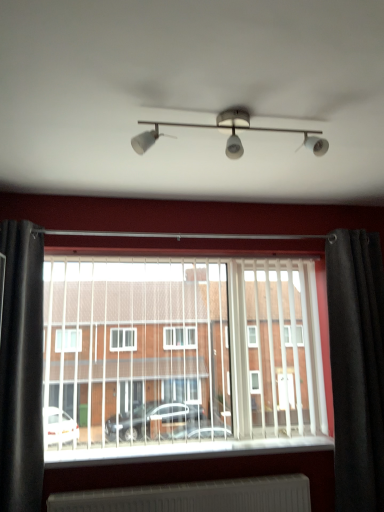
Question: Can you confirm if black velvet curtain at right, which ranks as the second curtain in left-to-right order, is thinner than black fabric curtain at left, the first curtain viewed from the left?

Choices:
 (A) yes
 (B) no

Answer: (B)

Question: Is black velvet curtain at right, marked as the first curtain in a right-to-left arrangement, facing away from black fabric curtain at left, the first curtain viewed from the left?

Choices:
 (A) yes
 (B) no

Answer: (B)

Question: Is black velvet curtain at right, marked as the first curtain in a right-to-left arrangement, positioned before black fabric curtain at left, the second curtain positioned from the right?

Choices:
 (A) no
 (B) yes

Answer: (A)

Question: From the image's perspective, does black velvet curtain at right, marked as the first curtain in a right-to-left arrangement, appear higher than black fabric curtain at left, the first curtain viewed from the left?

Choices:
 (A) no
 (B) yes

Answer: (A)

Question: Is black velvet curtain at right, which ranks as the second curtain in left-to-right order, next to black fabric curtain at left, the second curtain positioned from the right?

Choices:
 (A) no
 (B) yes

Answer: (A)

Question: Based on their positions, is white plastic blinds at center located to the left or right of black fabric curtain at left, the second curtain positioned from the right?

Choices:
 (A) right
 (B) left

Answer: (A)

Question: From the image's perspective, relative to black fabric curtain at left, the second curtain positioned from the right, is white plastic blinds at center above or below?

Choices:
 (A) below
 (B) above

Answer: (A)

Question: Is white plastic blinds at center wider or thinner than black fabric curtain at left, the first curtain viewed from the left?

Choices:
 (A) thin
 (B) wide

Answer: (A)

Question: Relative to black fabric curtain at left, the second curtain positioned from the right, is white plastic blinds at center in front or behind?

Choices:
 (A) front
 (B) behind

Answer: (B)

Question: Is white plastic blinds at center to the left or to the right of black velvet curtain at right, marked as the first curtain in a right-to-left arrangement, in the image?

Choices:
 (A) left
 (B) right

Answer: (A)

Question: Is white plastic blinds at center in front of or behind black velvet curtain at right, which ranks as the second curtain in left-to-right order, in the image?

Choices:
 (A) front
 (B) behind

Answer: (A)

Question: In terms of width, does white plastic blinds at center look wider or thinner when compared to black velvet curtain at right, which ranks as the second curtain in left-to-right order?

Choices:
 (A) thin
 (B) wide

Answer: (A)

Question: Considering the positions of white plastic blinds at center and black velvet curtain at right, which ranks as the second curtain in left-to-right order, in the image, is white plastic blinds at center taller or shorter than black velvet curtain at right, which ranks as the second curtain in left-to-right order,?

Choices:
 (A) tall
 (B) short

Answer: (B)

Question: From the image's perspective, relative to black velvet curtain at right, marked as the first curtain in a right-to-left arrangement, is black fabric curtain at left, the first curtain viewed from the left, above or below?

Choices:
 (A) above
 (B) below

Answer: (A)

Question: In terms of width, does black fabric curtain at left, the second curtain positioned from the right, look wider or thinner when compared to black velvet curtain at right, which ranks as the second curtain in left-to-right order?

Choices:
 (A) thin
 (B) wide

Answer: (A)